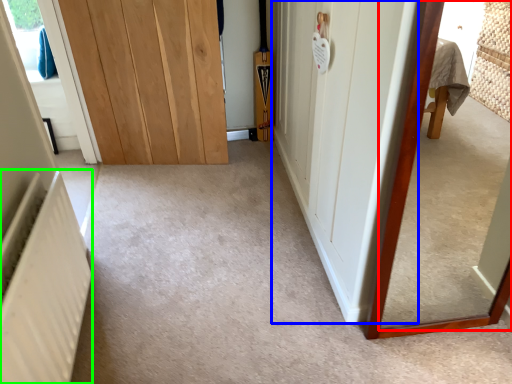
Question: Which is nearer to the mirror (highlighted by a red box)? door (highlighted by a blue box) or radiator (highlighted by a green box).

Choices:
 (A) door
 (B) radiator

Answer: (A)